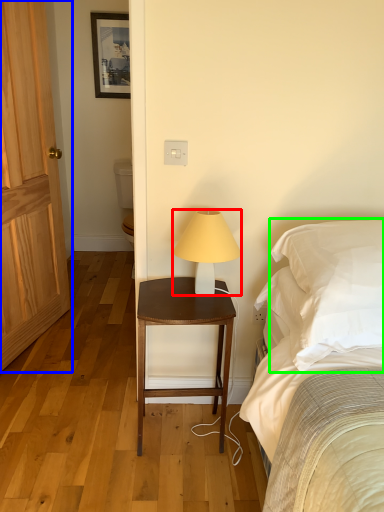
Question: Estimate the real-world distances between objects in this image. Which object is farther from lamp (highlighted by a red box), door (highlighted by a blue box) or pillow (highlighted by a green box)?

Choices:
 (A) door
 (B) pillow

Answer: (A)